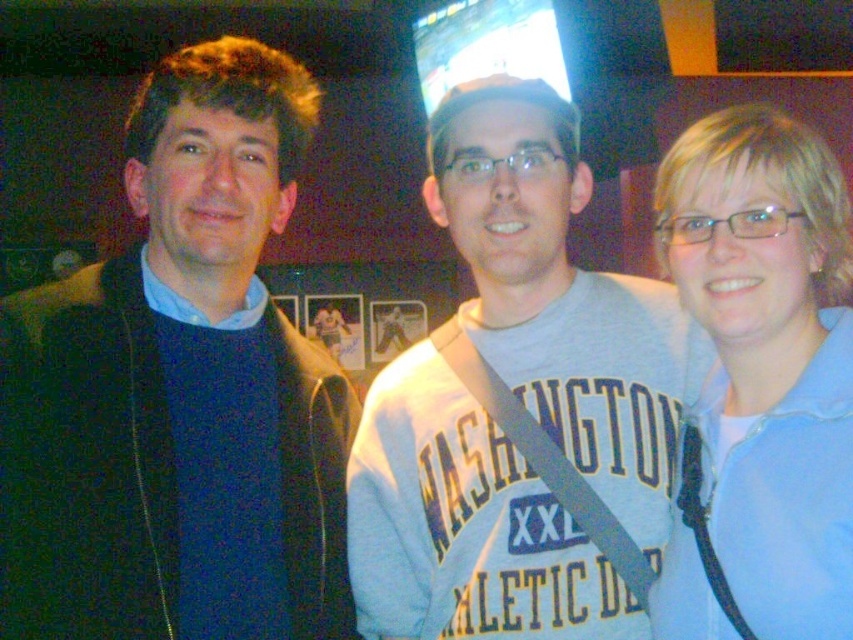
In the scene shown: Who is higher up, gray cotton sweatshirt at center or light blue fabric at right?

light blue fabric at right

Describe the element at coordinates (561, 298) in the screenshot. I see `gray cotton sweatshirt at center` at that location.

I want to click on gray cotton sweatshirt at center, so click(x=561, y=298).

Between blue matte sweater at left and gray cotton sweatshirt at center, which one appears on the left side from the viewer's perspective?

blue matte sweater at left

Can you confirm if blue matte sweater at left is wider than gray cotton sweatshirt at center?

No.

Who is more forward, [53,326] or [665,348]?

Point [53,326] is more forward.

Where is `blue matte sweater at left`? blue matte sweater at left is located at coordinates (178, 392).

Who is higher up, blue matte sweater at left or light blue fabric at right?

blue matte sweater at left is higher up.

Identify the location of blue matte sweater at left. (178, 392).

The image size is (853, 640). Find the location of `blue matte sweater at left`. blue matte sweater at left is located at coordinates (178, 392).